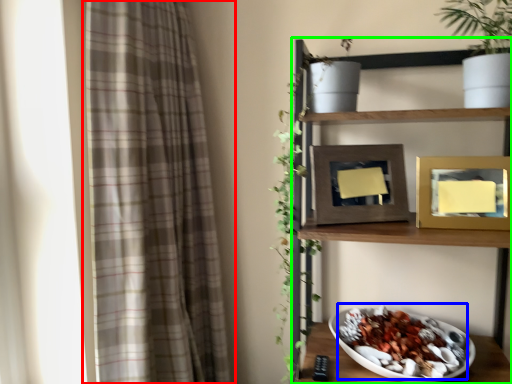
Question: Estimate the real-world distances between objects in this image. Which object is closer to curtain (highlighted by a red box), food (highlighted by a blue box) or shelf (highlighted by a green box)?

Choices:
 (A) food
 (B) shelf

Answer: (B)